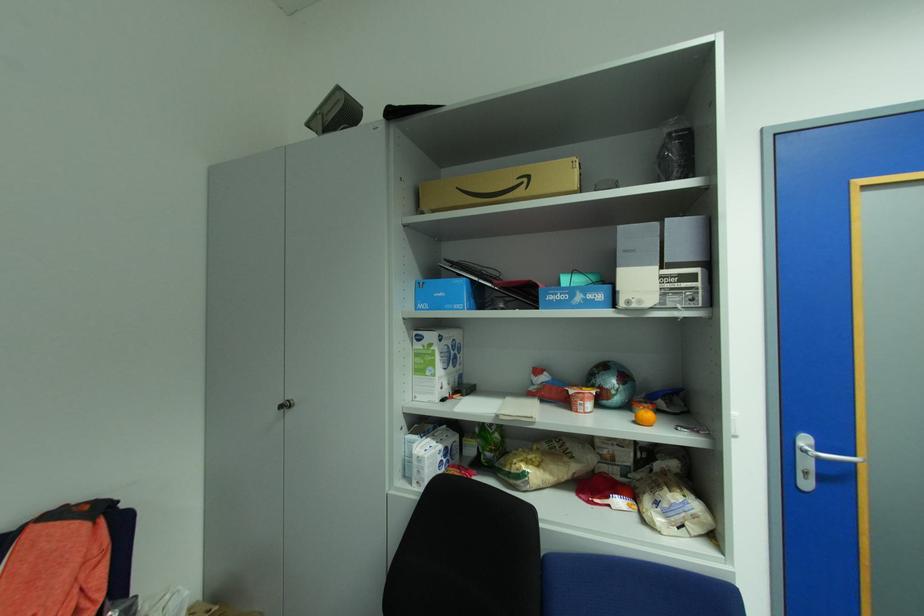
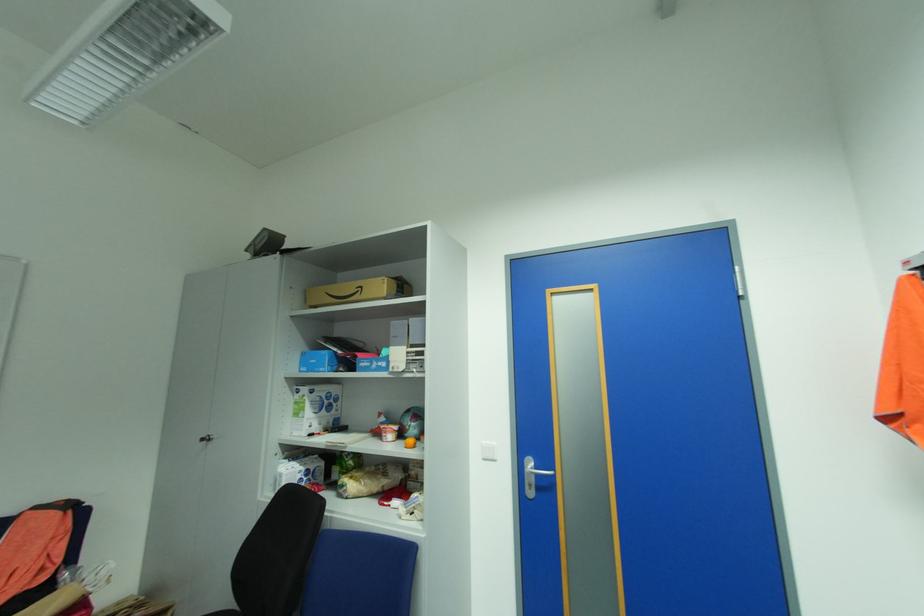
Where in the second image is the point corresponding to (x=463, y=306) from the first image?

(327, 370)